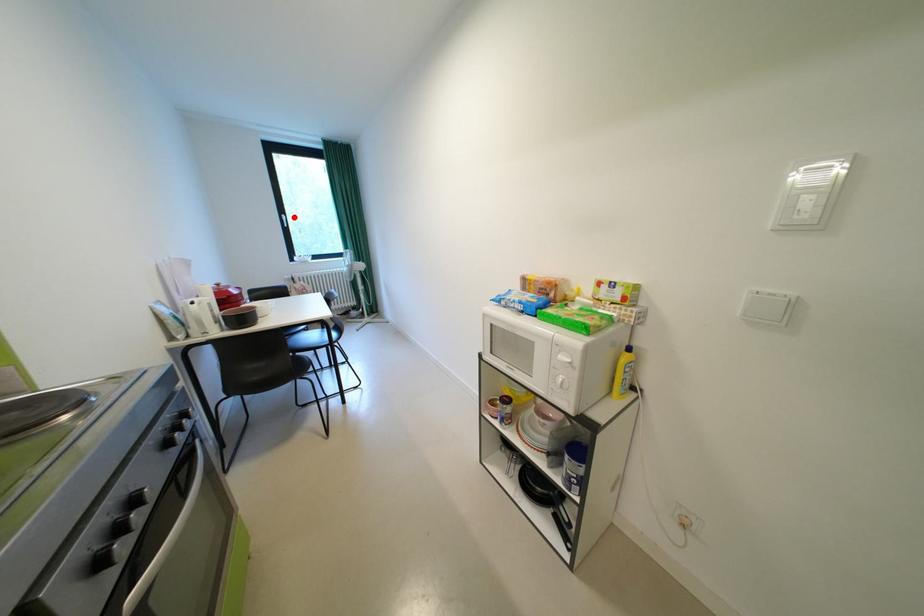
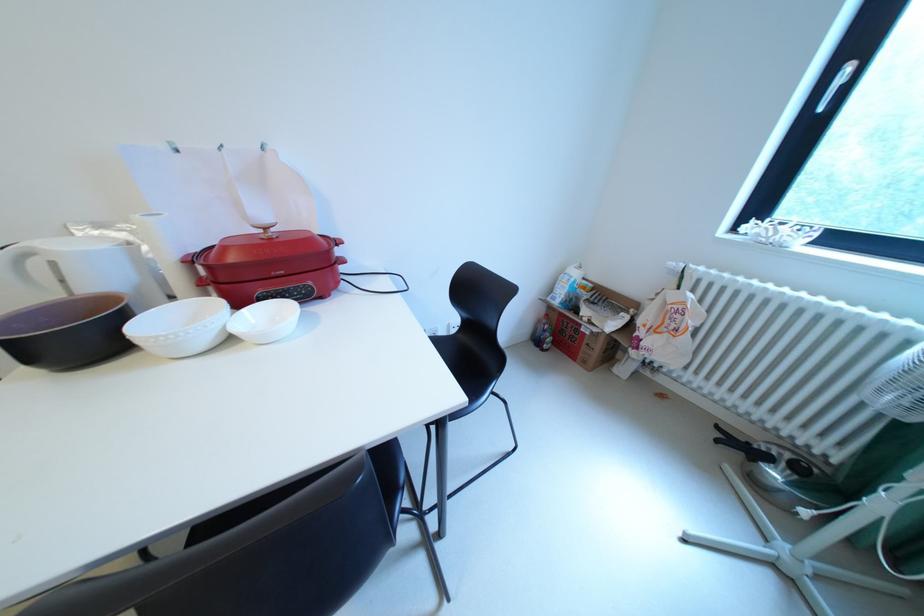
Question: I am providing you with two images of the same scene from different viewpoints. Given a red point in image1, look at the same physical point in image2. Is it:

Choices:
 (A) Closer to the viewpoint
 (B) Farther from the viewpoint

Answer: (B)